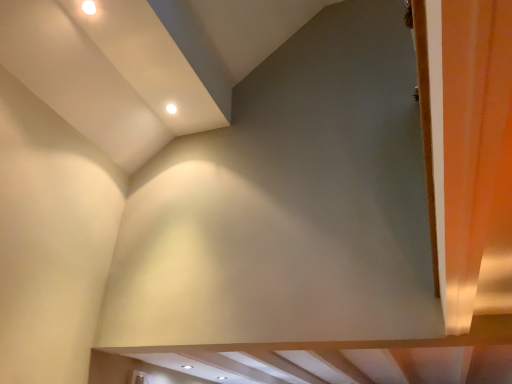
Question: In terms of width, does orange fabric curtain at right look wider or thinner when compared to white glossy light fixture at upper center?

Choices:
 (A) thin
 (B) wide

Answer: (B)

Question: Is orange fabric curtain at right to the left or to the right of white glossy light fixture at upper center in the image?

Choices:
 (A) left
 (B) right

Answer: (B)

Question: From a real-world perspective, is orange fabric curtain at right physically located above or below white glossy light fixture at upper center?

Choices:
 (A) above
 (B) below

Answer: (B)

Question: Looking at their shapes, would you say white glossy light fixture at upper center is wider or thinner than orange fabric curtain at right?

Choices:
 (A) wide
 (B) thin

Answer: (B)

Question: Is white glossy light fixture at upper center taller or shorter than orange fabric curtain at right?

Choices:
 (A) tall
 (B) short

Answer: (B)

Question: Considering the positions of white glossy light fixture at upper center and orange fabric curtain at right in the image, is white glossy light fixture at upper center bigger or smaller than orange fabric curtain at right?

Choices:
 (A) big
 (B) small

Answer: (B)

Question: From the image's perspective, is white glossy light fixture at upper center positioned above or below orange fabric curtain at right?

Choices:
 (A) below
 (B) above

Answer: (B)